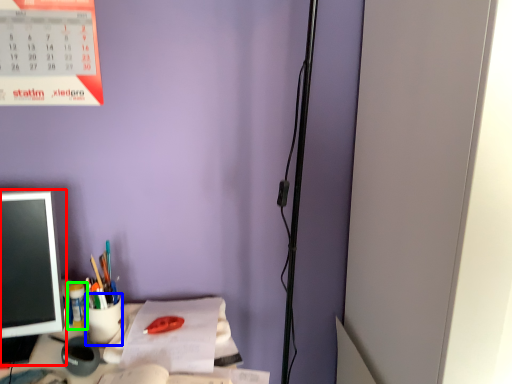
Question: Estimate the real-world distances between objects in this image. Which object is closer to office supplies (highlighted by a red box), stationery (highlighted by a blue box) or stationery (highlighted by a green box)?

Choices:
 (A) stationery
 (B) stationery

Answer: (B)